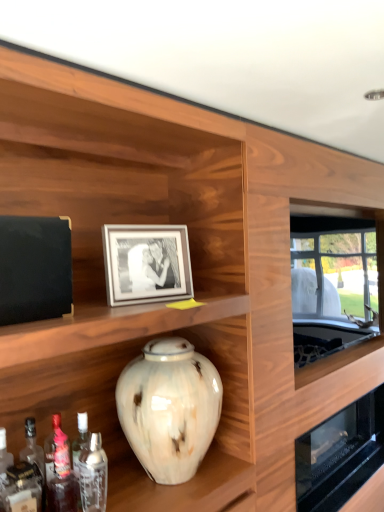
Question: Are matte silver picture frame at center and translucent glass bottle at lower left, marked as the second bottle in a right-to-left arrangement, far apart?

Choices:
 (A) no
 (B) yes

Answer: (A)

Question: Is matte silver picture frame at center in front of translucent glass bottle at lower left, which appears as the first bottle when viewed from the left?

Choices:
 (A) no
 (B) yes

Answer: (A)

Question: From the image's perspective, is matte silver picture frame at center below translucent glass bottle at lower left, which appears as the first bottle when viewed from the left?

Choices:
 (A) yes
 (B) no

Answer: (B)

Question: Is translucent glass bottle at lower left, which appears as the first bottle when viewed from the left, completely or partially inside matte silver picture frame at center?

Choices:
 (A) no
 (B) yes

Answer: (A)

Question: Does matte silver picture frame at center come behind translucent glass bottle at lower left, which appears as the first bottle when viewed from the left?

Choices:
 (A) no
 (B) yes

Answer: (B)

Question: From a real-world perspective, is matte silver picture frame at center physically below translucent glass bottle at lower left, marked as the second bottle in a right-to-left arrangement?

Choices:
 (A) no
 (B) yes

Answer: (A)

Question: Does translucent glass bottle at lower left, which appears as the first bottle when viewed from the left, have a lesser height compared to marbled ceramic vase at center?

Choices:
 (A) yes
 (B) no

Answer: (A)

Question: From the image's perspective, is translucent glass bottle at lower left, marked as the second bottle in a right-to-left arrangement, beneath marbled ceramic vase at center?

Choices:
 (A) no
 (B) yes

Answer: (B)

Question: Is translucent glass bottle at lower left, marked as the second bottle in a right-to-left arrangement, bigger than marbled ceramic vase at center?

Choices:
 (A) yes
 (B) no

Answer: (B)

Question: Is translucent glass bottle at lower left, marked as the second bottle in a right-to-left arrangement, turned away from marbled ceramic vase at center?

Choices:
 (A) yes
 (B) no

Answer: (B)

Question: Is translucent glass bottle at lower left, marked as the second bottle in a right-to-left arrangement, not inside marbled ceramic vase at center?

Choices:
 (A) no
 (B) yes

Answer: (B)

Question: Considering the relative positions of translucent glass bottle at lower left, which appears as the first bottle when viewed from the left, and marbled ceramic vase at center in the image provided, is translucent glass bottle at lower left, which appears as the first bottle when viewed from the left, to the right of marbled ceramic vase at center from the viewer's perspective?

Choices:
 (A) yes
 (B) no

Answer: (B)

Question: From the image's perspective, is translucent glass bottle at lower left, which appears as the first bottle when viewed from the left, on clear glass bottle at lower left, the second bottle positioned from the left?

Choices:
 (A) no
 (B) yes

Answer: (B)